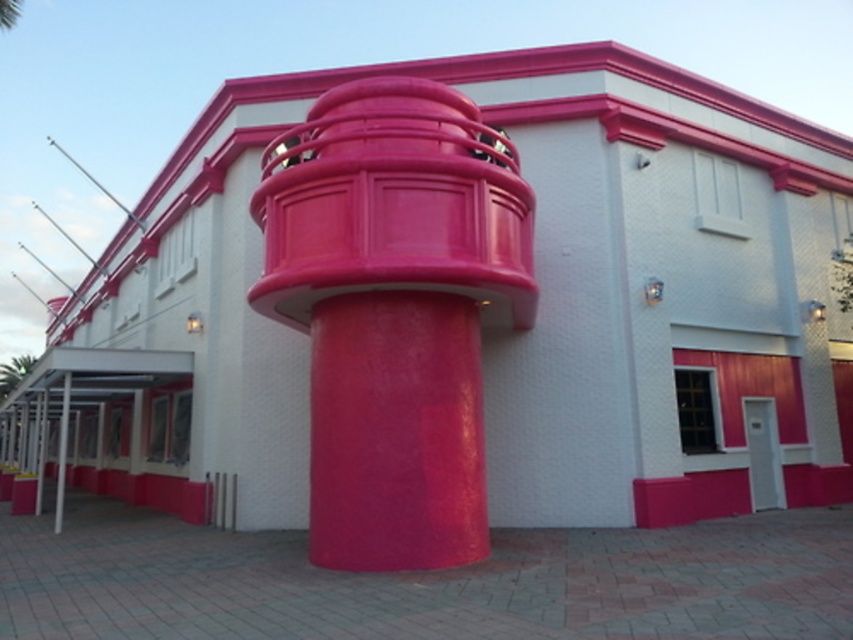
Does glossy plastic column at center have a smaller size compared to metallic silver pole at left?

Yes.

Which is in front, point (305, 230) or point (64, 442)?

Point (305, 230)

Where is `glossy plastic column at center`? The image size is (853, 640). glossy plastic column at center is located at coordinates (395, 308).